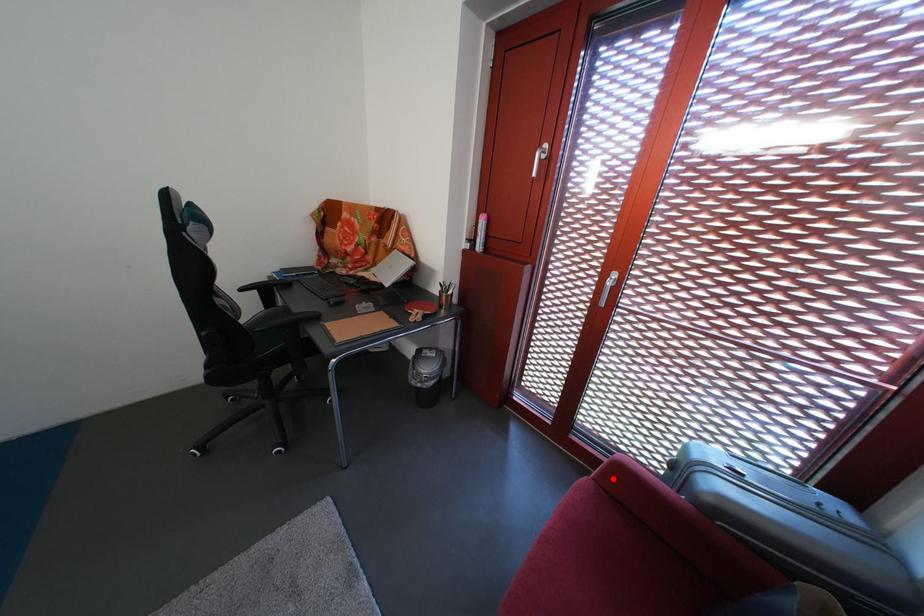
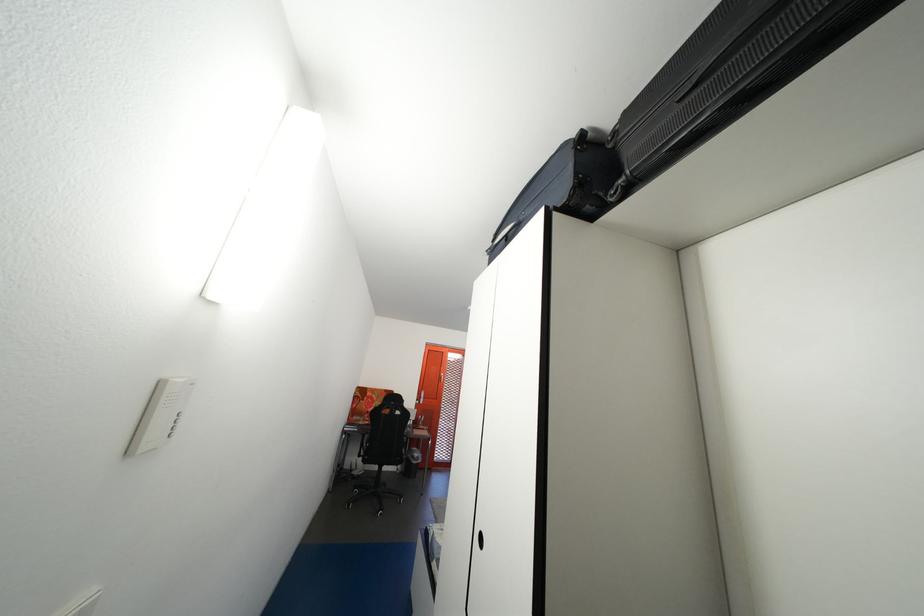
Question: I am providing you with two images of the same scene from different viewpoints. A red point is marked on the first image. At the location where the point appears in image 1, is it still visible in image 2?

Choices:
 (A) Yes
 (B) No

Answer: (B)